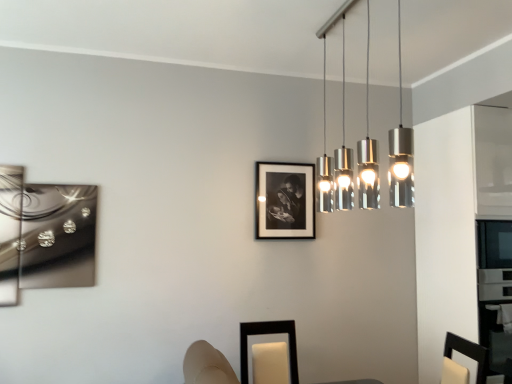
Question: In which direction should I rotate to look at silver metallic pendant lights at upper center?

Choices:
 (A) left
 (B) right

Answer: (B)

Question: Does metallic silver abstract art at left, which is counted as the second picture frame, starting from the front, have a lesser height compared to black matte picture frame at center, acting as the third picture frame starting from the bottom?

Choices:
 (A) no
 (B) yes

Answer: (A)

Question: Is metallic silver abstract art at left, which is the 2th picture frame in back-to-front order, closer to the viewer compared to black matte picture frame at center, the 3th picture frame viewed from the left?

Choices:
 (A) no
 (B) yes

Answer: (B)

Question: Does metallic silver abstract art at left, which ranks as the 3th picture frame in right-to-left order, have a lesser width compared to black matte picture frame at center, marked as the first picture frame in a right-to-left arrangement?

Choices:
 (A) yes
 (B) no

Answer: (B)

Question: From a real-world perspective, is metallic silver abstract art at left, which is the first picture frame in left-to-right order, physically below black matte picture frame at center, positioned as the 1th picture frame in back-to-front order?

Choices:
 (A) yes
 (B) no

Answer: (A)

Question: Is black matte picture frame at center, the 3th picture frame viewed from the left, completely or partially inside metallic silver abstract art at left, which is the 2th picture frame in back-to-front order?

Choices:
 (A) yes
 (B) no

Answer: (B)

Question: From a real-world perspective, is metallic silver abstract art at left, which is the first picture frame in left-to-right order, positioned over black matte picture frame at center, marked as the first picture frame in a right-to-left arrangement, based on gravity?

Choices:
 (A) yes
 (B) no

Answer: (B)

Question: Is silver metallic pendant lights at upper center to the left of black matte picture frame at lower center, positioned as the second picture frame in left-to-right order, from the viewer's perspective?

Choices:
 (A) yes
 (B) no

Answer: (B)

Question: Can you confirm if silver metallic pendant lights at upper center is thinner than black matte picture frame at lower center, positioned as the second picture frame in left-to-right order?

Choices:
 (A) yes
 (B) no

Answer: (A)

Question: Does silver metallic pendant lights at upper center come behind black matte picture frame at lower center, the 2th picture frame when ordered from right to left?

Choices:
 (A) no
 (B) yes

Answer: (A)

Question: Would you say black matte picture frame at lower center, placed as the third picture frame when sorted from back to front, is part of silver metallic pendant lights at upper center's contents?

Choices:
 (A) yes
 (B) no

Answer: (B)

Question: Is silver metallic pendant lights at upper center closer to the viewer compared to black matte picture frame at lower center, the 2th picture frame when ordered from right to left?

Choices:
 (A) yes
 (B) no

Answer: (A)

Question: From a real-world perspective, is silver metallic pendant lights at upper center on black matte picture frame at lower center, which ranks as the third picture frame in top-to-bottom order?

Choices:
 (A) no
 (B) yes

Answer: (B)

Question: Could you tell me if metallic silver abstract art at left, placed as the 2th picture frame when sorted from bottom to top, is turned towards black matte picture frame at lower center, positioned as the second picture frame in left-to-right order?

Choices:
 (A) no
 (B) yes

Answer: (A)